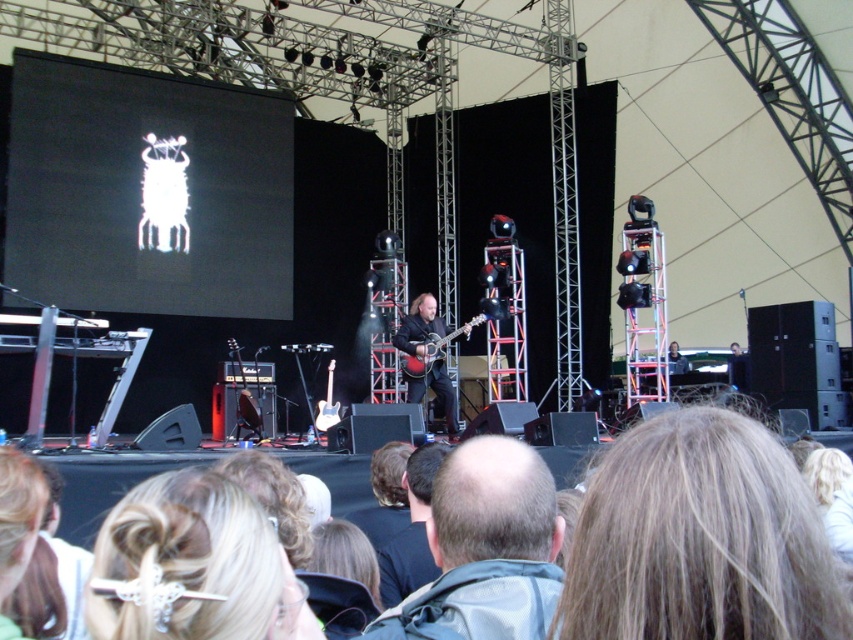
Is light brown hair at center shorter than dark brown leather jacket at center?

Incorrect, light brown hair at center's height does not fall short of dark brown leather jacket at center's.

Between point (502, 474) and point (392, 548), which one is positioned behind?

Point (392, 548)

The image size is (853, 640). I want to click on light brown hair at center, so click(x=485, y=548).

Measure the distance between blonde hair at lower center and light brown hair at center.

blonde hair at lower center and light brown hair at center are 1.05 meters apart from each other.

Is blonde hair at lower center thinner than light brown hair at center?

In fact, blonde hair at lower center might be wider than light brown hair at center.

Where is `blonde hair at lower center`? This screenshot has width=853, height=640. blonde hair at lower center is located at coordinates (700, 540).

Can you confirm if blonde hair at lower center is thinner than dark brown leather jacket at center?

No.

Between point (630, 625) and point (425, 445), which one is positioned behind?

The point (425, 445) is behind.

This screenshot has width=853, height=640. Find the location of `blonde hair at lower center`. blonde hair at lower center is located at coordinates (700, 540).